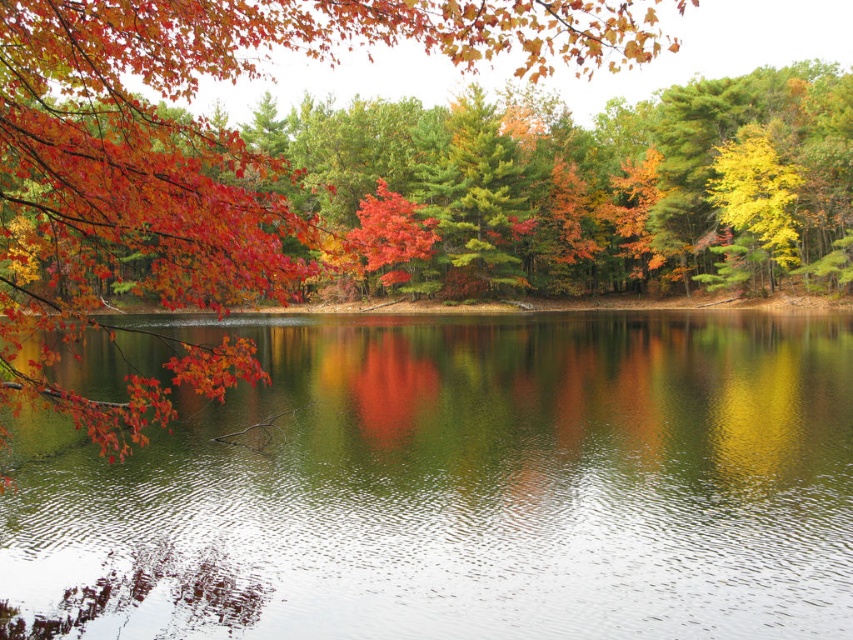
Question: Does green reflective water at center appear under shiny red leaves at upper left?

Choices:
 (A) yes
 (B) no

Answer: (A)

Question: Among these points, which one is farthest from the camera?

Choices:
 (A) (178, 1)
 (B) (846, 333)

Answer: (B)

Question: Which point appears farthest from the camera in this image?

Choices:
 (A) (326, 477)
 (B) (0, 292)

Answer: (A)

Question: Can you confirm if green reflective water at center is positioned below shiny red leaves at upper left?

Choices:
 (A) yes
 (B) no

Answer: (A)

Question: Does green reflective water at center lie in front of shiny red leaves at upper left?

Choices:
 (A) yes
 (B) no

Answer: (B)

Question: Which point is closer to the camera taking this photo?

Choices:
 (A) (624, 634)
 (B) (527, 42)

Answer: (B)